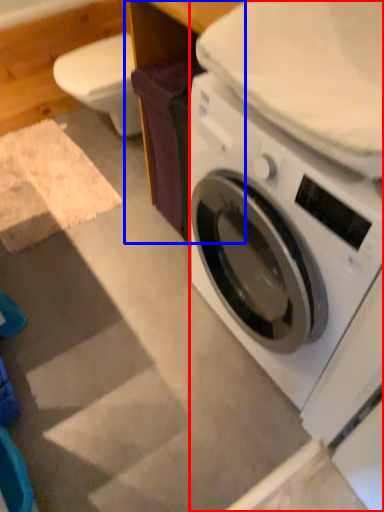
Question: Among these objects, which one is farthest to the camera, washing machine (highlighted by a red box) or table (highlighted by a blue box)?

Choices:
 (A) washing machine
 (B) table

Answer: (B)